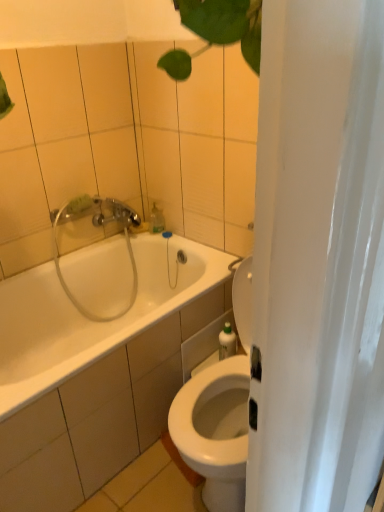
Question: Considering the positions of translucent plastic soap dispenser at upper center and clear plastic showerhead at upper left in the image, is translucent plastic soap dispenser at upper center wider or thinner than clear plastic showerhead at upper left?

Choices:
 (A) thin
 (B) wide

Answer: (A)

Question: Choose the correct answer: Is translucent plastic soap dispenser at upper center inside clear plastic showerhead at upper left or outside it?

Choices:
 (A) outside
 (B) inside

Answer: (B)

Question: Based on their relative distances, which object is farther from the white glossy bathtub at center?

Choices:
 (A) clear plastic showerhead at upper left
 (B) green plastic bottle at right
 (C) translucent plastic soap dispenser at upper center

Answer: (B)

Question: Considering the real-world distances, which object is closest to the translucent plastic soap dispenser at upper center?

Choices:
 (A) green plastic bottle at right
 (B) clear plastic showerhead at upper left
 (C) white glossy bathtub at center

Answer: (B)